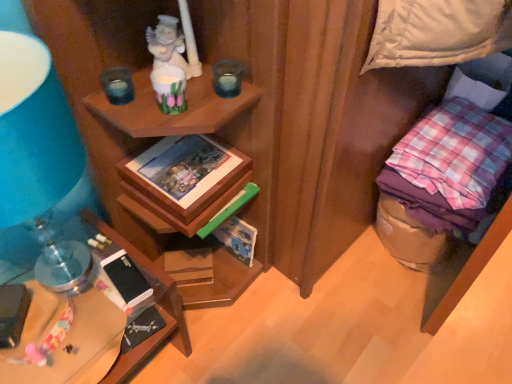
Question: Should I look upward or downward to see black matte mobile phone at lower left, which is counted as the second mobile phone, starting from the right?

Choices:
 (A) up
 (B) down

Answer: (B)

Question: Can you confirm if brown cardboard magazine at lower center is thinner than pink checkered fabric at right?

Choices:
 (A) yes
 (B) no

Answer: (A)

Question: From the image's perspective, is brown cardboard magazine at lower center under pink checkered fabric at right?

Choices:
 (A) no
 (B) yes

Answer: (B)

Question: Does brown cardboard magazine at lower center have a lesser height compared to pink checkered fabric at right?

Choices:
 (A) yes
 (B) no

Answer: (A)

Question: Is brown cardboard magazine at lower center at the right side of pink checkered fabric at right?

Choices:
 (A) yes
 (B) no

Answer: (B)

Question: Is pink checkered fabric at right at the back of brown cardboard magazine at lower center?

Choices:
 (A) no
 (B) yes

Answer: (A)

Question: From a real-world perspective, does brown cardboard magazine at lower center sit lower than pink checkered fabric at right?

Choices:
 (A) no
 (B) yes

Answer: (B)

Question: Is wooden desk at lower left shorter than black matte mobile phone at lower left, the first mobile phone viewed from the left?

Choices:
 (A) no
 (B) yes

Answer: (A)

Question: Does wooden desk at lower left appear on the left side of black matte mobile phone at lower left, which is counted as the second mobile phone, starting from the right?

Choices:
 (A) yes
 (B) no

Answer: (B)

Question: Does wooden desk at lower left have a greater width compared to black matte mobile phone at lower left, the first mobile phone viewed from the left?

Choices:
 (A) yes
 (B) no

Answer: (A)

Question: From the image's perspective, does wooden desk at lower left appear higher than black matte mobile phone at lower left, the first mobile phone viewed from the left?

Choices:
 (A) yes
 (B) no

Answer: (B)

Question: Is black matte mobile phone at lower left, the first mobile phone viewed from the left, completely or partially inside wooden desk at lower left?

Choices:
 (A) no
 (B) yes

Answer: (A)

Question: From a real-world perspective, is wooden desk at lower left physically above black matte mobile phone at lower left, the first mobile phone viewed from the left?

Choices:
 (A) yes
 (B) no

Answer: (B)

Question: Does brown cardboard magazine at lower center have a lesser width compared to black matte mobile phone at lower left, which is counted as the second mobile phone, starting from the right?

Choices:
 (A) no
 (B) yes

Answer: (B)